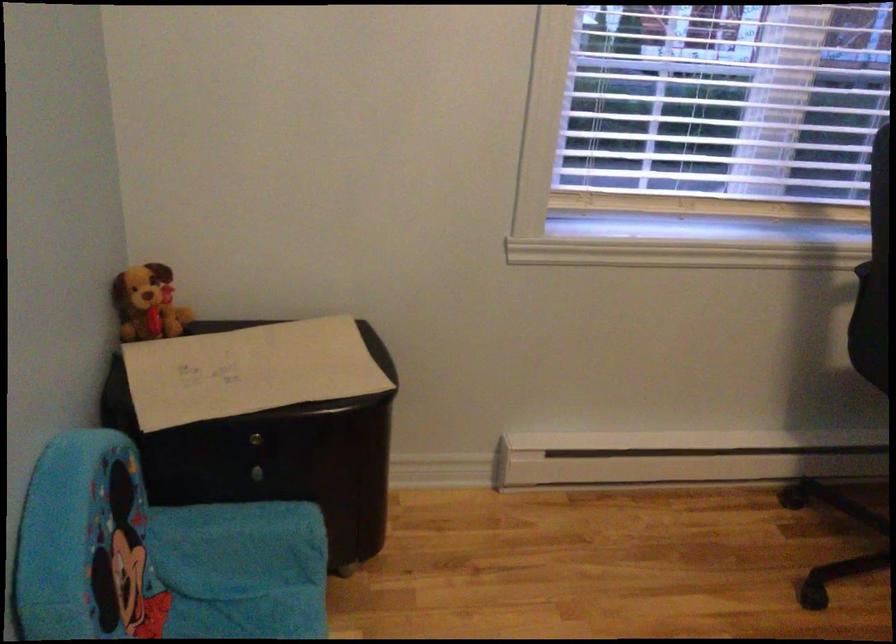
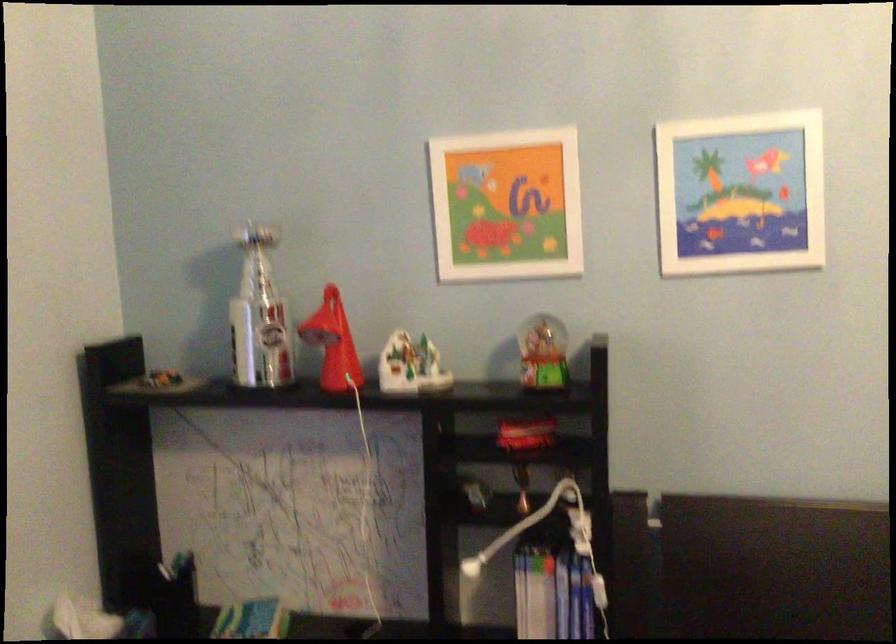
Question: The camera is either moving clockwise (left) or counter-clockwise (right) around the object. The first image is from the beginning of the video and the second image is from the end. Is the camera moving left or right when shooting the video?

Choices:
 (A) Left
 (B) Right

Answer: (A)